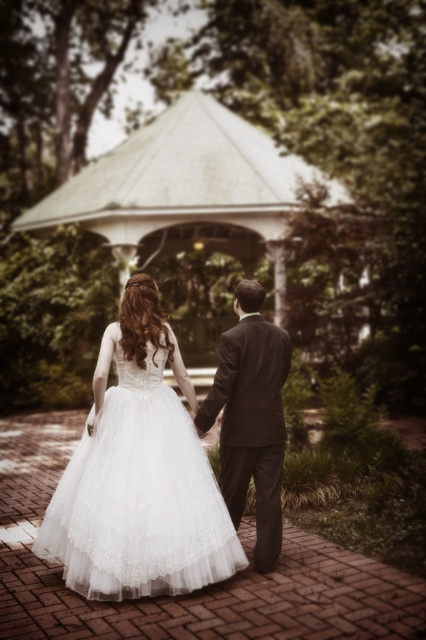
Question: Among these points, which one is farthest from the camera?

Choices:
 (A) (187, 483)
 (B) (221, 433)

Answer: (B)

Question: Which object is closer to the camera taking this photo?

Choices:
 (A) dark brown suit at center
 (B) white lace dress at center

Answer: (B)

Question: Can you confirm if white lace dress at center is smaller than dark brown suit at center?

Choices:
 (A) yes
 (B) no

Answer: (B)

Question: Does white lace dress at center have a larger size compared to dark brown suit at center?

Choices:
 (A) yes
 (B) no

Answer: (A)

Question: Can you confirm if white lace dress at center is smaller than dark brown suit at center?

Choices:
 (A) yes
 (B) no

Answer: (B)